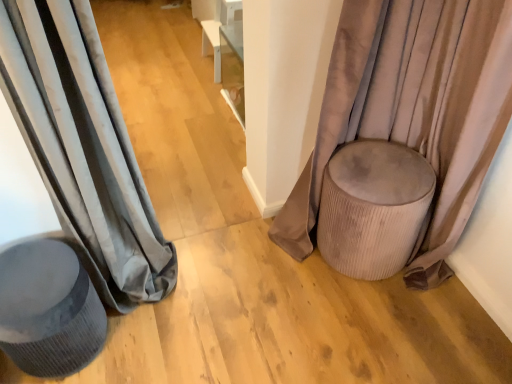
The image size is (512, 384). What are the coordinates of `empty space that is in between matte gray curtain at left, the 1th curtain viewed from the left, and velvet beige pouf at right, the 2th curtain viewed from the left` in the screenshot? It's located at (239, 253).